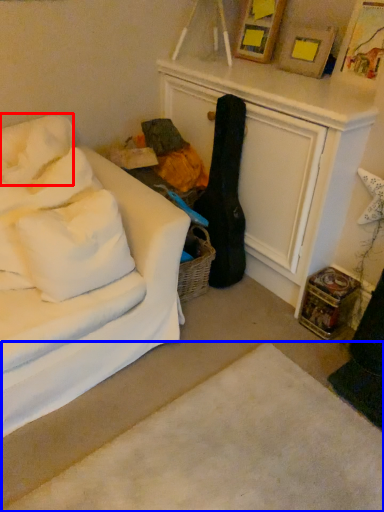
Question: Which point is further to the camera, pillow (highlighted by a red box) or plain (highlighted by a blue box)?

Choices:
 (A) pillow
 (B) plain

Answer: (A)